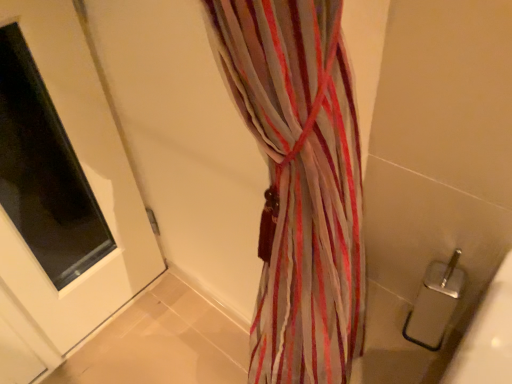
Locate an element on the screen. The width and height of the screenshot is (512, 384). white glossy door at left is located at coordinates (88, 180).

What do you see at coordinates (88, 180) in the screenshot? I see `white glossy door at left` at bounding box center [88, 180].

At what (x,y) coordinates should I click in order to perform the action: click on white glossy door at left. Please return your answer as a coordinate pair (x, y). This screenshot has width=512, height=384. Looking at the image, I should click on (88, 180).